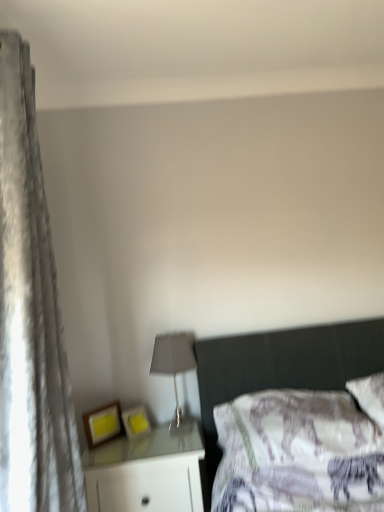
Locate an element on the screen. vacant location below matte gray lampshade at center (from a real-world perspective) is located at coordinates (178, 429).